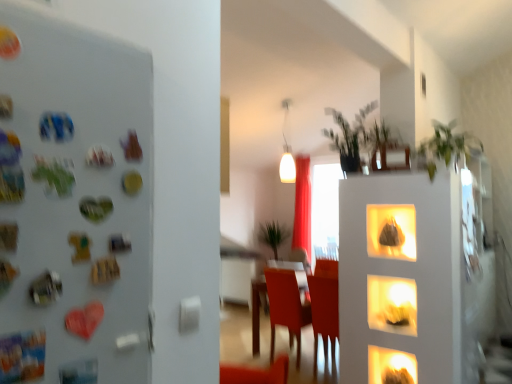
Question: Are green leafy plant at upper center, which is the second plant from back to front, and matte white shelf at center beside each other?

Choices:
 (A) no
 (B) yes

Answer: (A)

Question: Does green leafy plant at upper center, which is the second plant from back to front, have a greater height compared to matte white shelf at center?

Choices:
 (A) yes
 (B) no

Answer: (A)

Question: Is green leafy plant at upper center, which is counted as the first plant, starting from the top, positioned with its back to matte white shelf at center?

Choices:
 (A) yes
 (B) no

Answer: (B)

Question: Is matte white shelf at center completely or partially inside green leafy plant at upper center, which is counted as the first plant, starting from the top?

Choices:
 (A) no
 (B) yes

Answer: (A)

Question: Does green leafy plant at upper center, acting as the 4th plant starting from the bottom, have a lesser width compared to matte white shelf at center?

Choices:
 (A) no
 (B) yes

Answer: (A)

Question: Can you confirm if green leafy plant at upper center, which is the second plant from back to front, is positioned to the left of matte white shelf at center?

Choices:
 (A) yes
 (B) no

Answer: (A)

Question: Is white glossy lamp at upper center to the right of red velvet curtain at center from the viewer's perspective?

Choices:
 (A) no
 (B) yes

Answer: (A)

Question: Does white glossy lamp at upper center come in front of red velvet curtain at center?

Choices:
 (A) yes
 (B) no

Answer: (A)

Question: Does white glossy lamp at upper center have a greater width compared to red velvet curtain at center?

Choices:
 (A) yes
 (B) no

Answer: (B)

Question: Would you say red velvet curtain at center is part of white glossy lamp at upper center's contents?

Choices:
 (A) yes
 (B) no

Answer: (B)

Question: From the image's perspective, would you say white glossy lamp at upper center is shown under red velvet curtain at center?

Choices:
 (A) no
 (B) yes

Answer: (A)

Question: Is white glossy lamp at upper center not within red velvet curtain at center?

Choices:
 (A) yes
 (B) no

Answer: (A)

Question: Is green leafy plant at upper center, acting as the 4th plant starting from the bottom, next to matte plastic chair at center?

Choices:
 (A) yes
 (B) no

Answer: (B)